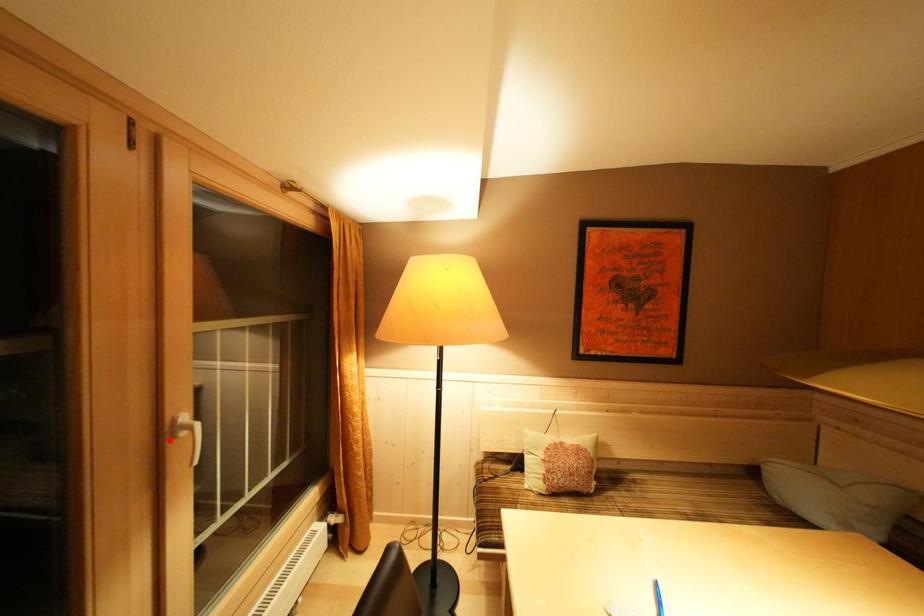
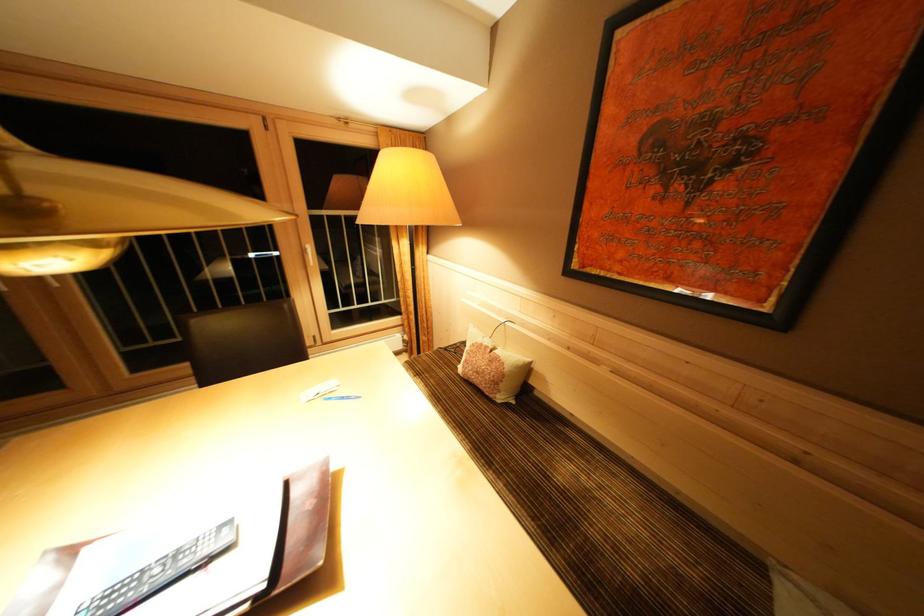
Find the pixel in the second image that matches the highlighted location in the first image.

(310, 256)